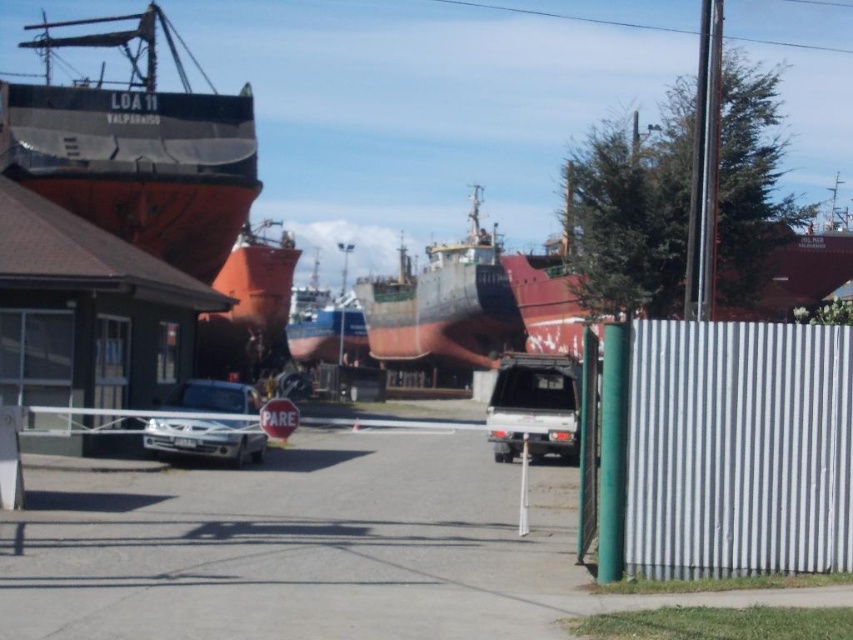
Looking at this image, does rusty metal ship at center appear on the left side of satin silver truck at center?

Yes, rusty metal ship at center is to the left of satin silver truck at center.

This screenshot has height=640, width=853. Describe the element at coordinates (444, 304) in the screenshot. I see `rusty metal ship at center` at that location.

Is point (466, 346) positioned behind point (532, 404)?

Yes.

The height and width of the screenshot is (640, 853). What are the coordinates of `rusty metal ship at center` in the screenshot? It's located at point(444,304).

Who is lower down, rusty metal ship at left or rusty metal ship at center?

Positioned lower is rusty metal ship at center.

This screenshot has width=853, height=640. Describe the element at coordinates (136, 148) in the screenshot. I see `rusty metal ship at left` at that location.

You are a GUI agent. You are given a task and a screenshot of the screen. Output one action in this format:
    pyautogui.click(x=<x>, y=<y>)
    Task: Click on the rusty metal ship at left
    The height and width of the screenshot is (640, 853).
    Given the screenshot: What is the action you would take?
    click(136, 148)

Is silver corrugated fence at right above white matte stop sign at center?

Yes, silver corrugated fence at right is above white matte stop sign at center.

Who is lower down, silver corrugated fence at right or white matte stop sign at center?

Positioned lower is white matte stop sign at center.

Between point (851, 435) and point (271, 416), which one is positioned in front?

Point (851, 435) is in front.

At what (x,y) coordinates should I click in order to perform the action: click on silver corrugated fence at right. Please return your answer as a coordinate pair (x, y). The width and height of the screenshot is (853, 640). Looking at the image, I should click on (738, 449).